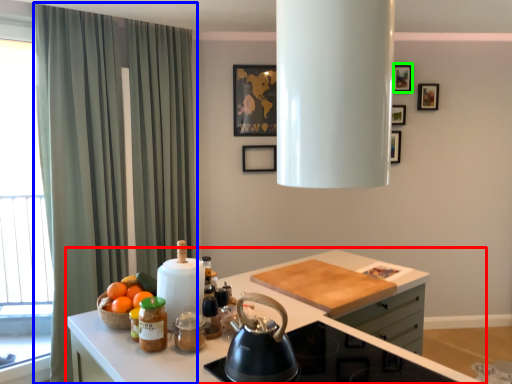
Question: Which object is the closest to the countertop (highlighted by a red box)? Choose among these: curtain (highlighted by a blue box) or picture frame (highlighted by a green box).

Choices:
 (A) curtain
 (B) picture frame

Answer: (A)